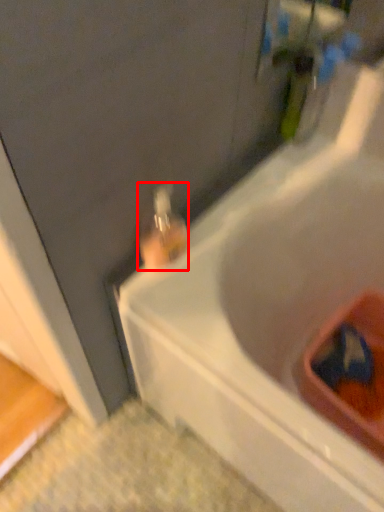
Question: Observing the image, what is the correct spatial positioning of bottle (annotated by the red box) in reference to bathtub?

Choices:
 (A) right
 (B) left

Answer: (B)